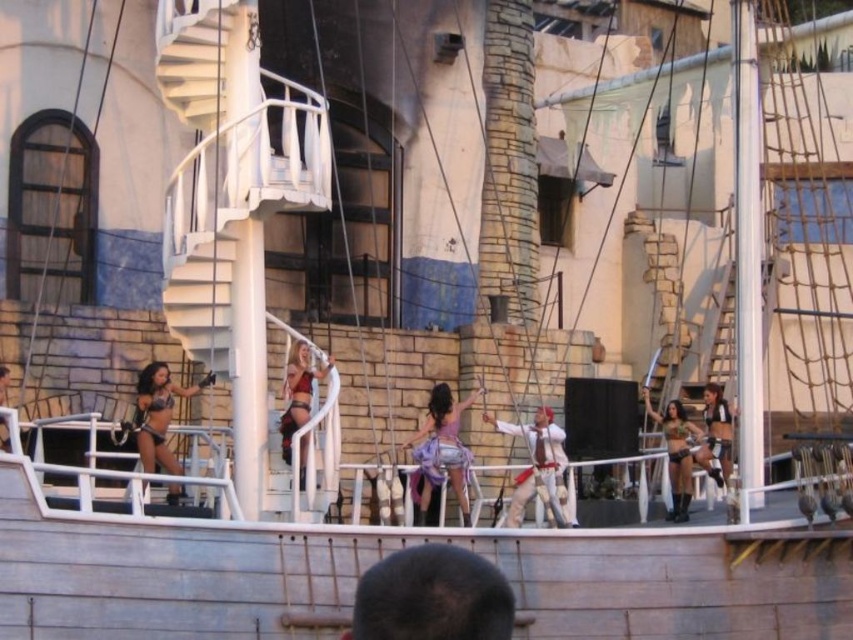
Question: Does purple satin dress at center have a larger size compared to satin gold bikini at center?

Choices:
 (A) yes
 (B) no

Answer: (A)

Question: Considering the real-world distances, which object is farthest from the shiny silver armor at right?

Choices:
 (A) reddish-brown leather vest at center
 (B) satin gold bikini at center
 (C) shiny metallic bikini at left
 (D) dark brown fur hat at lower center

Answer: (D)

Question: Can you confirm if purple satin dress at center is positioned to the right of satin gold bikini at center?

Choices:
 (A) no
 (B) yes

Answer: (A)

Question: Which point is closer to the camera?

Choices:
 (A) shiny metallic bikini at left
 (B) satin gold bikini at center

Answer: (A)

Question: Which point appears closest to the camera in this image?

Choices:
 (A) (432, 452)
 (B) (289, 412)
 (C) (399, 634)
 (D) (558, 436)

Answer: (C)

Question: Is reddish-brown leather vest at center to the right of shiny leather boots at center from the viewer's perspective?

Choices:
 (A) no
 (B) yes

Answer: (B)